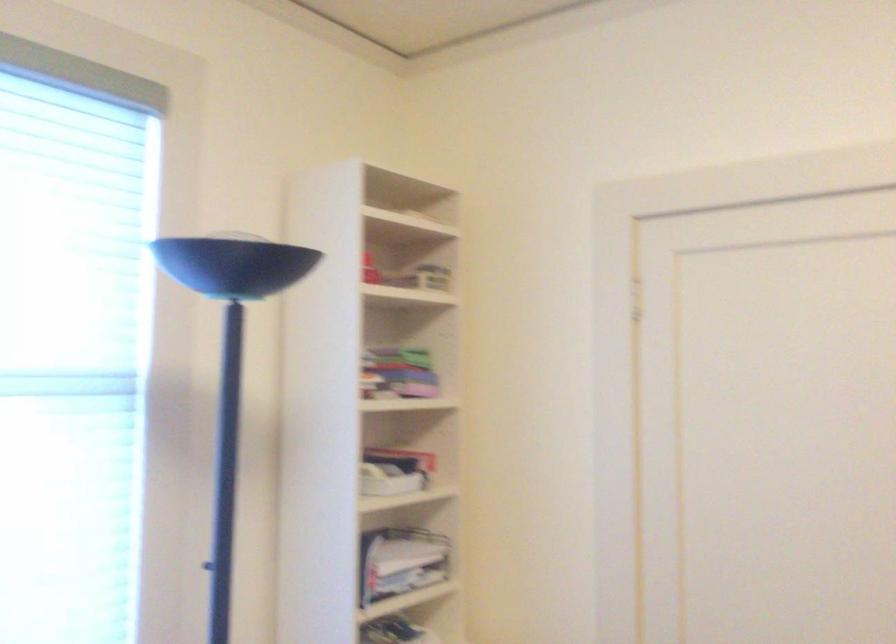
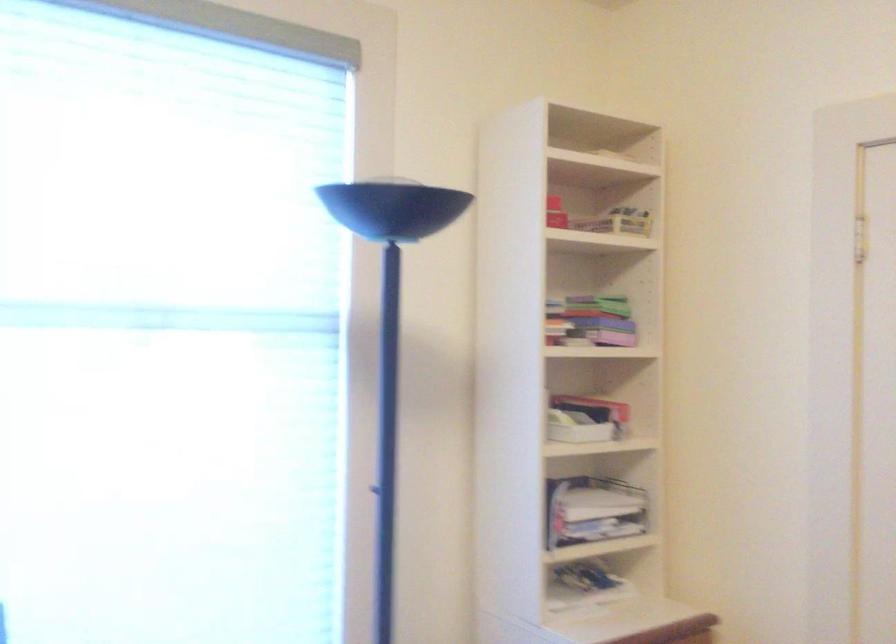
Locate, in the second image, the point that corresponds to pixel 403 562 in the first image.

(592, 509)